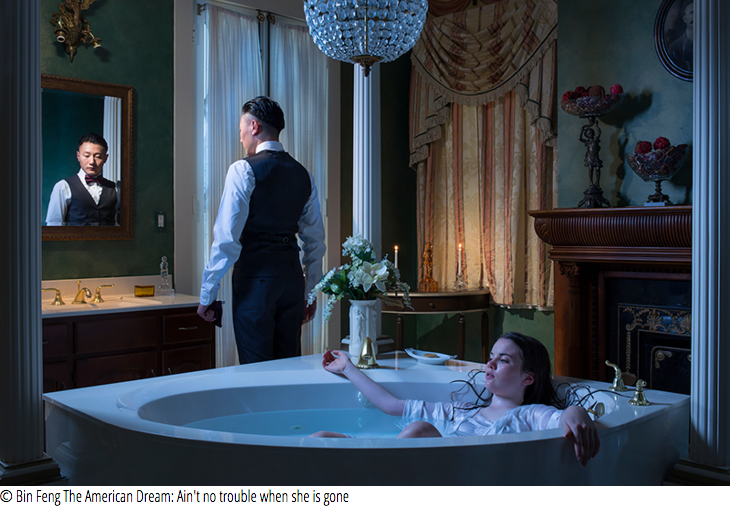
This screenshot has width=732, height=515. I want to click on wall, so click(616, 47), click(149, 31).